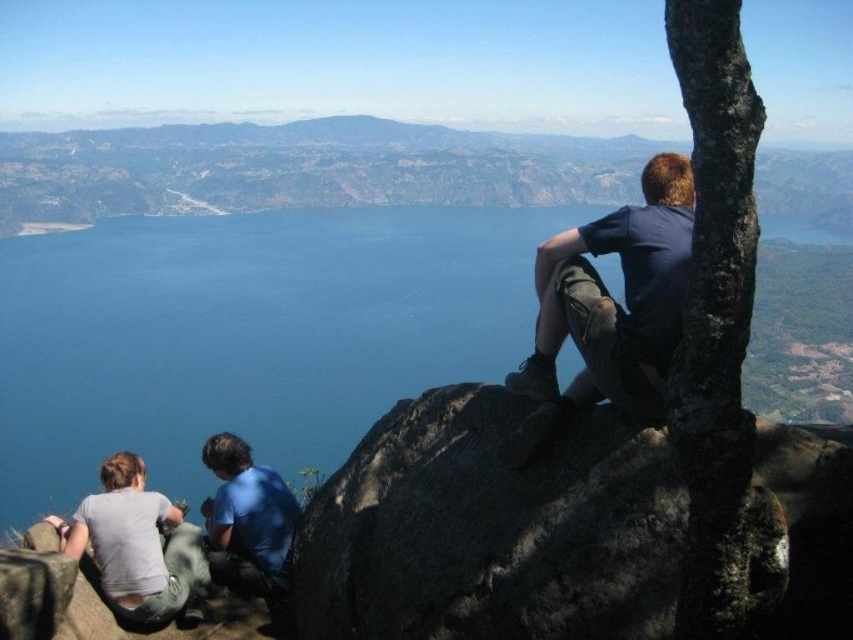
Question: Based on their relative distances, which object is farther from the light gray cotton shirt at lower left?

Choices:
 (A) dark blue shirt at upper right
 (B) dark gray rock at upper right
 (C) blue matte shirt at lower left

Answer: (A)

Question: Among these objects, which one is farthest from the camera?

Choices:
 (A) dark blue shirt at upper right
 (B) dark gray rock at upper right
 (C) blue water at center
 (D) light gray cotton shirt at lower left

Answer: (C)

Question: Can you confirm if blue water at center is thinner than dark gray rock at upper right?

Choices:
 (A) no
 (B) yes

Answer: (A)

Question: Can you confirm if dark blue shirt at upper right is positioned below light gray cotton shirt at lower left?

Choices:
 (A) yes
 (B) no

Answer: (B)

Question: Which point is farther from the camera taking this photo?

Choices:
 (A) (592, 368)
 (B) (283, 396)
 (C) (421, 432)
 (D) (277, 561)

Answer: (B)

Question: Considering the relative positions of blue water at center and light gray cotton shirt at lower left in the image provided, where is blue water at center located with respect to light gray cotton shirt at lower left?

Choices:
 (A) above
 (B) below

Answer: (A)